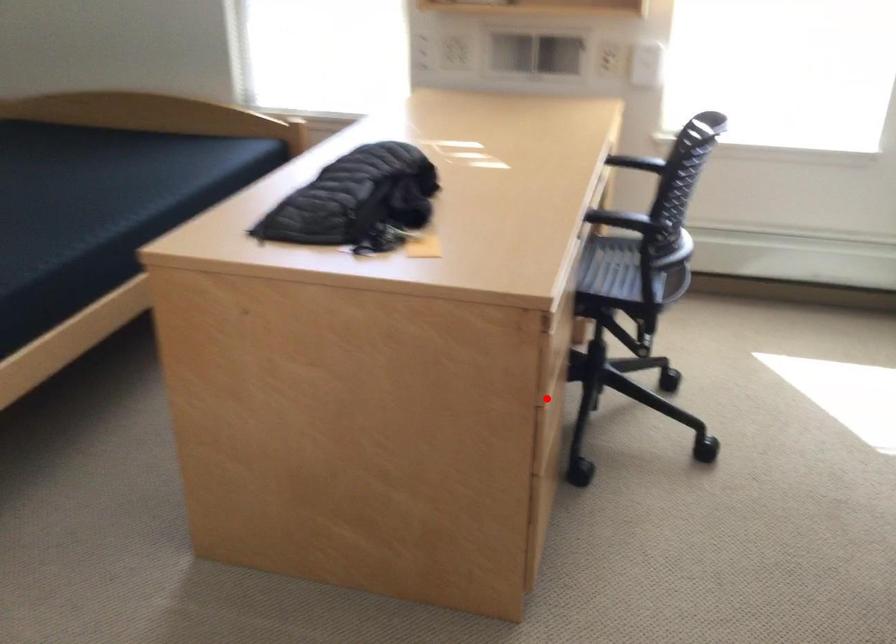
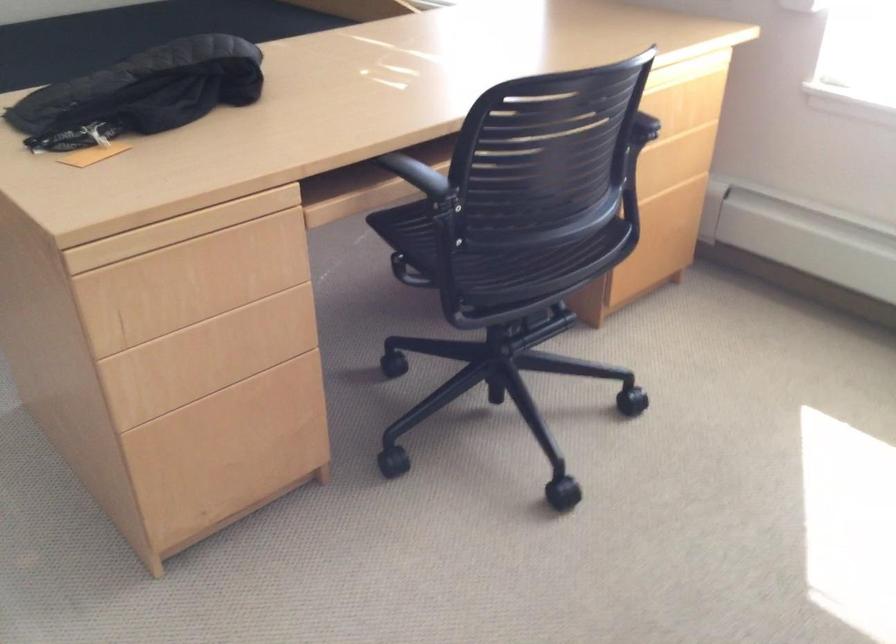
Locate, in the second image, the point that corresponds to the highlighted location in the first image.

(201, 361)